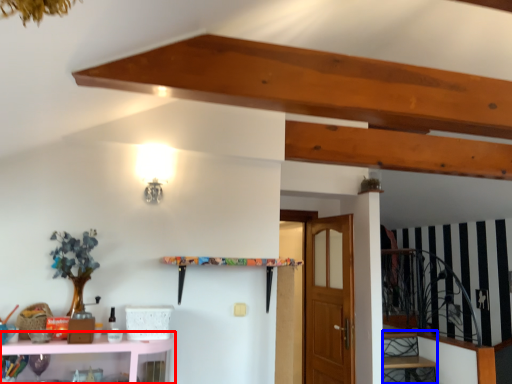
Question: Which object is further to the camera taking this photo, shelf (highlighted by a red box) or stairwell (highlighted by a blue box)?

Choices:
 (A) shelf
 (B) stairwell

Answer: (B)